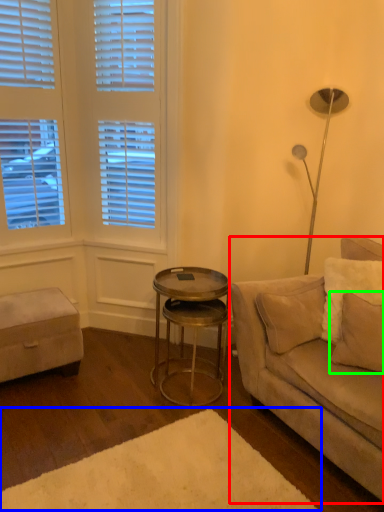
Question: Which is farther away from studio couch (highlighted by a red box)? plain (highlighted by a blue box) or pillow (highlighted by a green box)?

Choices:
 (A) plain
 (B) pillow

Answer: (A)